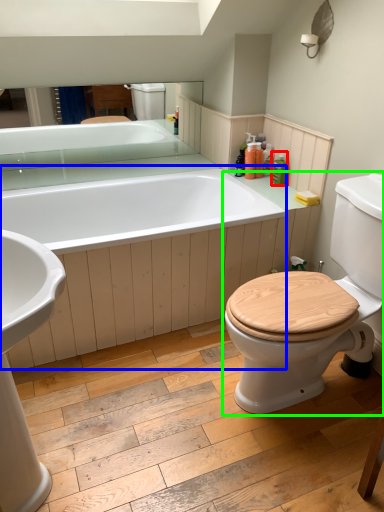
Question: Based on their relative distances, which object is farther from toiletry (highlighted by a red box)? Choose from bath (highlighted by a blue box) and toilet (highlighted by a green box).

Choices:
 (A) bath
 (B) toilet

Answer: (B)